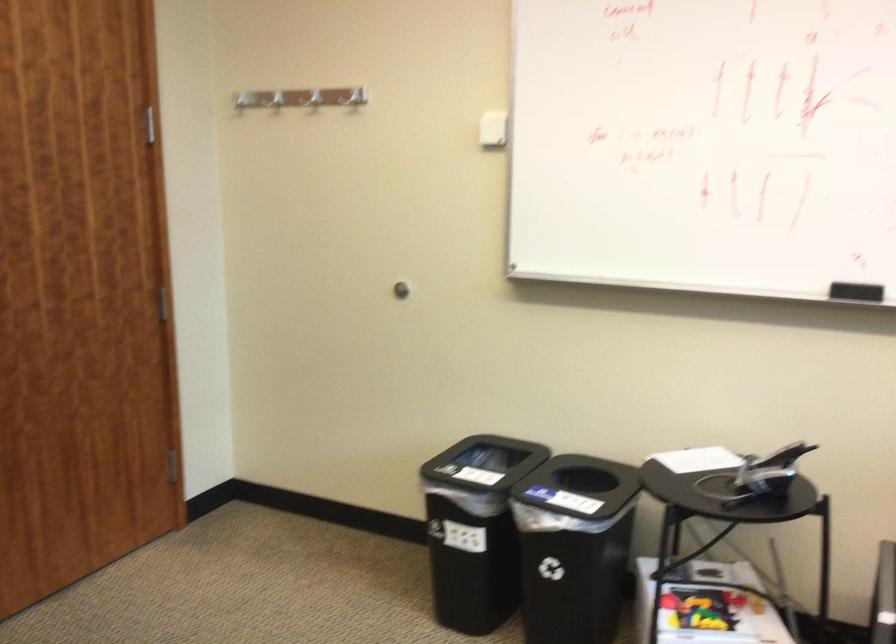
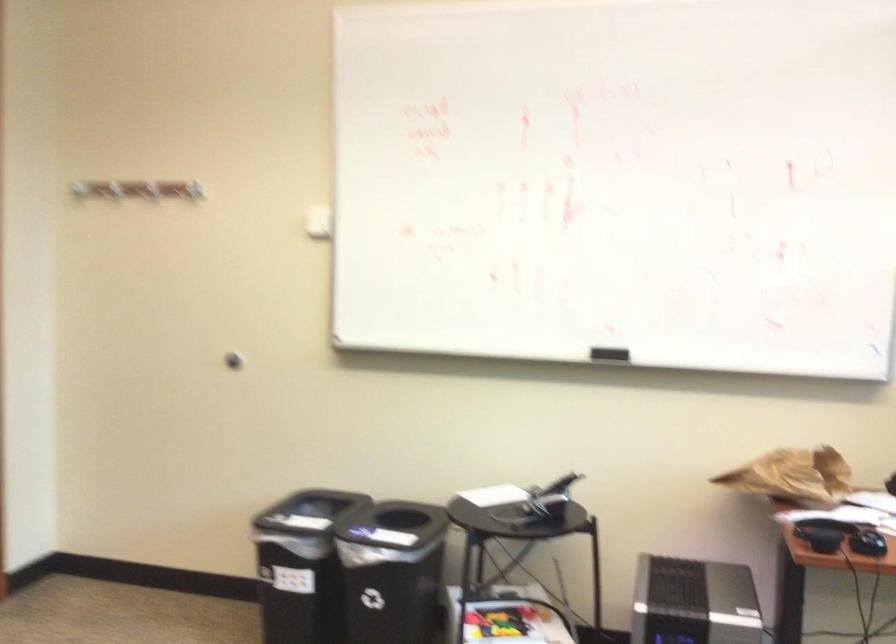
Question: Based on the continuous images, in which direction is the camera rotating? Reply with the corresponding letter.

Choices:
 (A) Left
 (B) Right
 (C) Up
 (D) Down

Answer: (B)